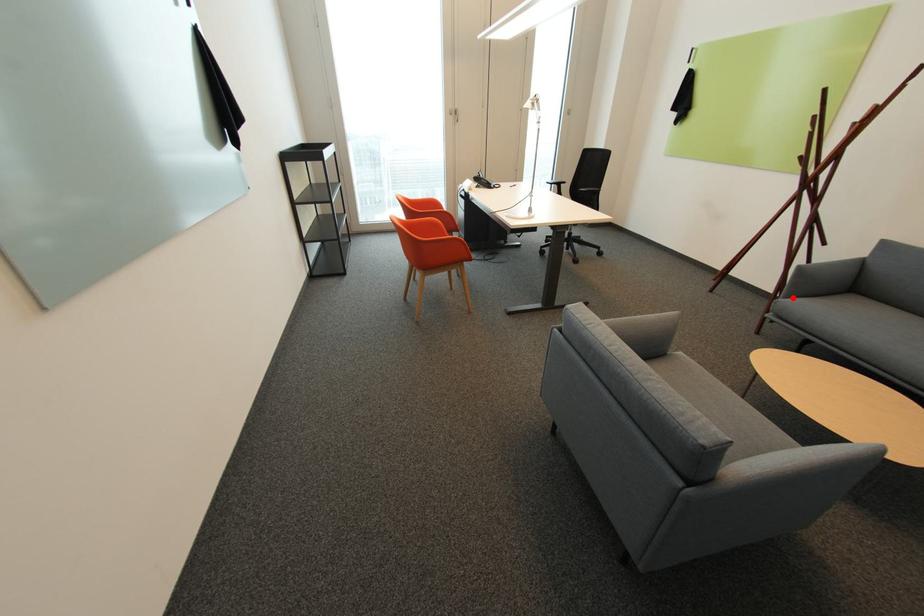
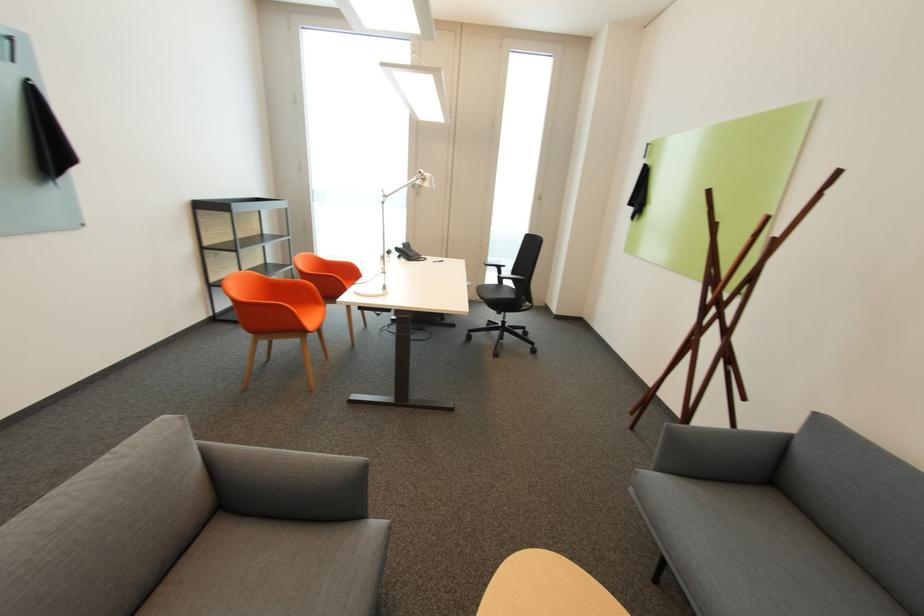
Question: I am providing you with two images of the same scene from different viewpoints. Image1 has a red point marked. In image2, the corresponding 3D location appears at what relative position? Reply with the corresponding letter.

Choices:
 (A) Closer
 (B) Farther

Answer: (A)